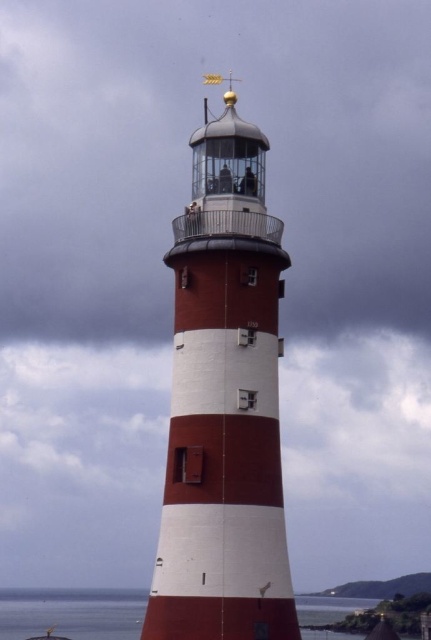
You are a seagull flying over the ocean and see the smooth white lighthouse at center and the transparent water at lower left. Which object is higher in elevation?

The smooth white lighthouse at center is located above the transparent water at lower left, so it has a higher elevation.

Based on the photo, you are a bird flying over a coastal area and spot the smooth white lighthouse at center and the transparent water at lower left. Which object is taller?

The smooth white lighthouse at center is taller than the transparent water at lower left.

You are standing at the base of the lighthouse and looking upward. There are two points marked on the lighthouse structure. Which point, point [239,440] or point [127,636], is closer to your line of sight when you look directly ahead?

Point [239,440] is closer to your line of sight because it is in front of point [127,636].